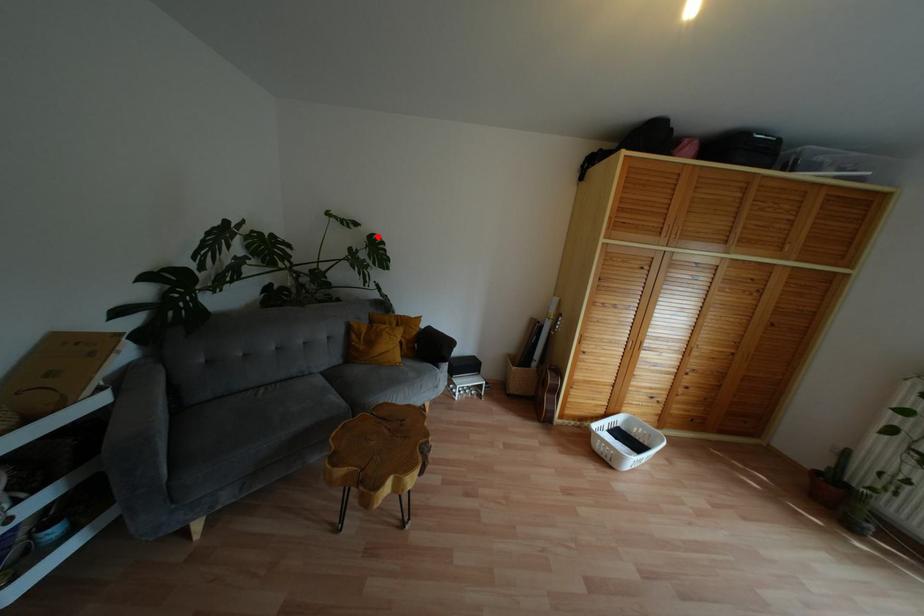
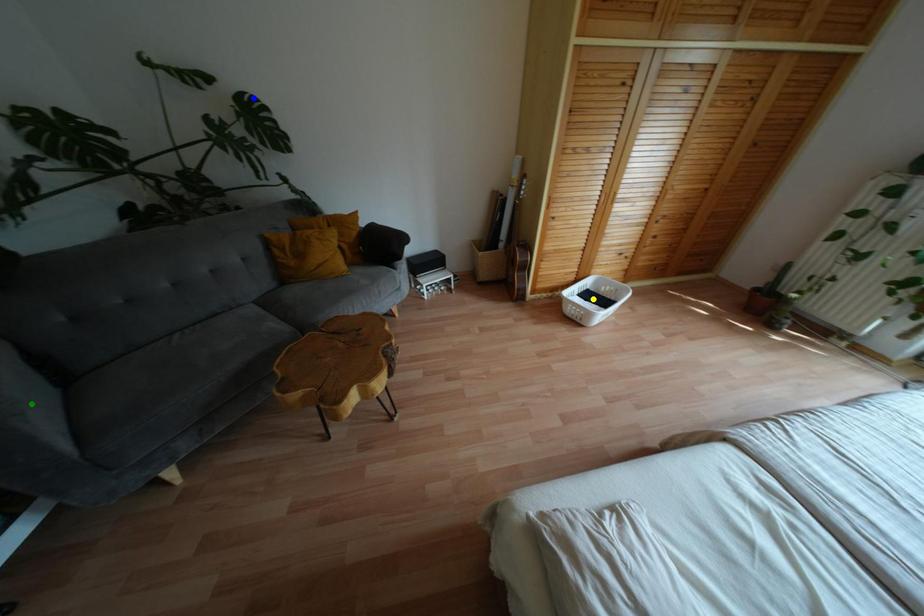
Question: I am providing you with two images of the same scene from different viewpoints. A red point is marked on the first image. You are given multiple points on the second image. Can you choose the point in image 2 that corresponds to the point in image 1?

Choices:
 (A) yellow point
 (B) green point
 (C) blue point

Answer: (C)